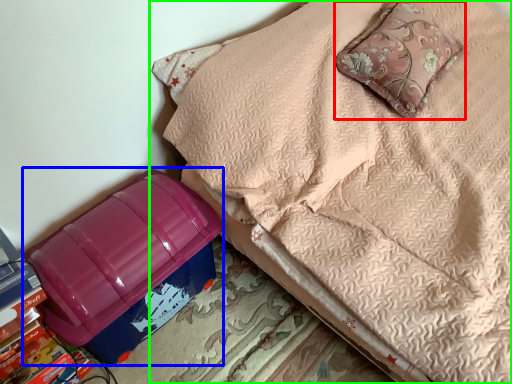
Question: Which object is positioned farthest from pillow (highlighted by a red box)? Select from storage box (highlighted by a blue box) and furniture (highlighted by a green box).

Choices:
 (A) storage box
 (B) furniture

Answer: (A)